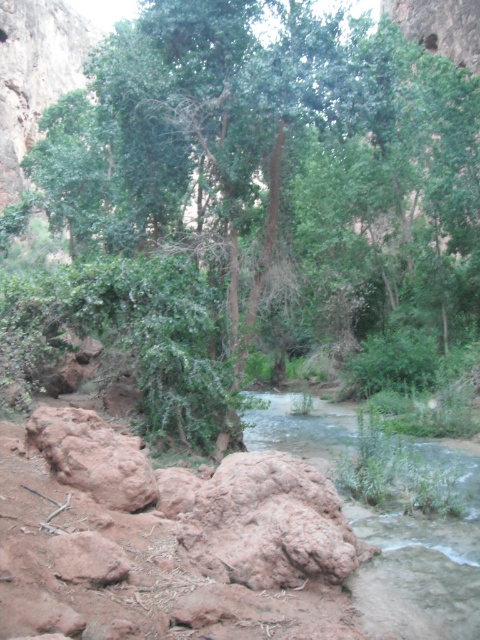
Does green leafy tree at center appear over clear water at center?

Yes.

Looking at this image, how far apart are green leafy tree at center and clear water at center?

They are 37.64 feet apart.

Is point (429, 204) in front of point (474, 515)?

No, (429, 204) is behind (474, 515).

This screenshot has height=640, width=480. I want to click on green leafy tree at center, so click(261, 189).